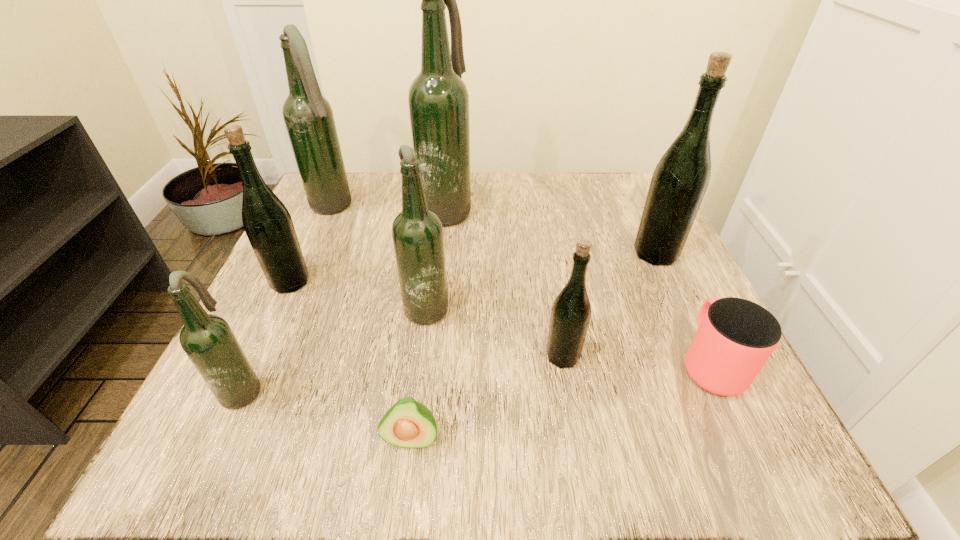
This screenshot has height=540, width=960. Identify the location of dark beer bottle that is the third nearest to the seventh nearest object. (308, 116).

Identify which dark beer bottle is the second closest to the sixth beer bottle from left to right. Please provide its 2D coordinates. Your answer should be formatted as a tuple, i.e. [(x, y)], where the tuple contains the x and y coordinates of a point satisfying the conditions above.

[(438, 99)]

The width and height of the screenshot is (960, 540). I want to click on green beer bottle that is the third nearest to the pink cup, so click(x=268, y=225).

This screenshot has width=960, height=540. I want to click on green beer bottle that is the closest to the nearest dark beer bottle, so click(x=268, y=225).